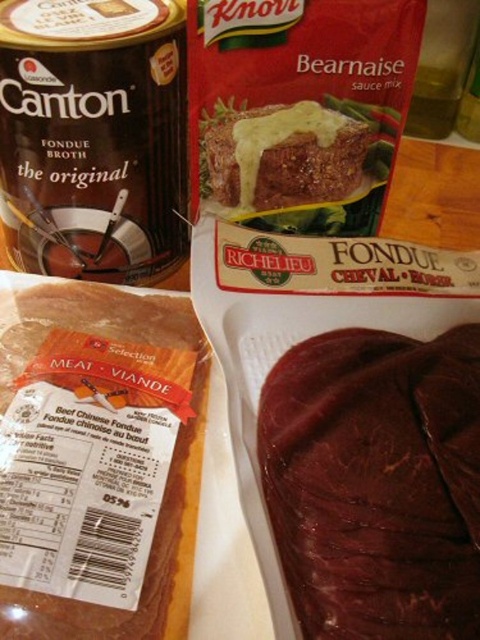
You are a chef preparing a meal and see the brown glossy meat at center and the dark brown glossy meat at lower right on the counter. Which meat is taller?

The brown glossy meat at center is taller than the dark brown glossy meat at lower right.

You are preparing to arrange the brown glossy meat at center and the dark brown glossy meat at lower right on a plate. Which meat should you place first if you want to arrange them from largest to smallest?

The brown glossy meat at center should be placed first because it is bigger than the dark brown glossy meat at lower right.